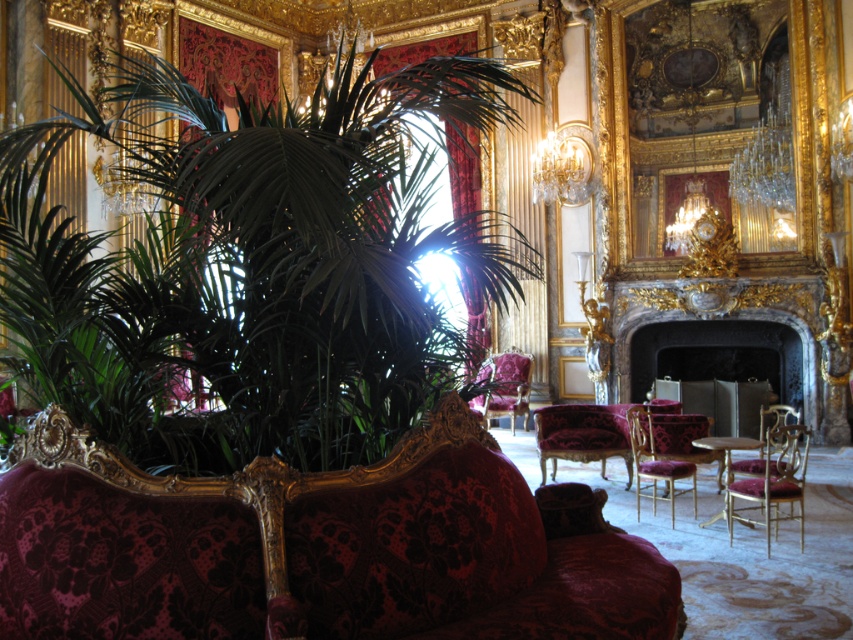
Is velvet gold armchair at center positioned at the back of velvet purple armchair at center?

That is False.

Who is positioned more to the right, velvet gold armchair at center or velvet purple armchair at center?

velvet gold armchair at center

Identify the location of velvet gold armchair at center. (654, 461).

Image resolution: width=853 pixels, height=640 pixels. Identify the location of velvet gold armchair at center. (654, 461).

Can you confirm if green leafy plant at left is positioned to the left of velvet burgundy armchair at right?

Yes, green leafy plant at left is to the left of velvet burgundy armchair at right.

Which is above, green leafy plant at left or velvet burgundy armchair at right?

green leafy plant at left is above.

Between point (305, 468) and point (802, 486), which one is positioned in front?

Point (305, 468) is in front.

Locate an element on the screen. This screenshot has width=853, height=640. green leafy plant at left is located at coordinates point(254,268).

Does velvet couch at center appear over velvet purple armchair at center?

Yes.

Is point (228, 518) positioned before point (514, 412)?

Yes, point (228, 518) is in front of point (514, 412).

At what (x,y) coordinates should I click in order to perform the action: click on velvet couch at center. Please return your answer as a coordinate pair (x, y). Image resolution: width=853 pixels, height=640 pixels. Looking at the image, I should click on [x=331, y=545].

Where is `velvet couch at center`? The height and width of the screenshot is (640, 853). velvet couch at center is located at coordinates (331, 545).